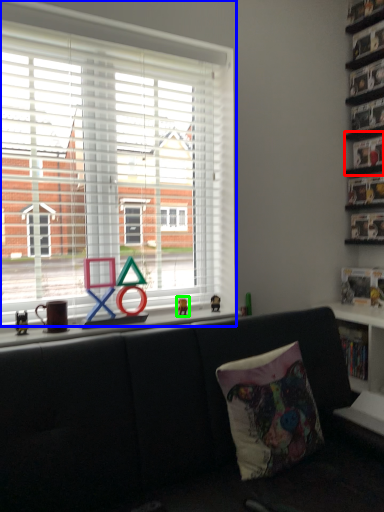
Question: Which object is positioned closest to shelf (highlighted by a red box)? Select from window (highlighted by a blue box) and miniature (highlighted by a green box).

Choices:
 (A) window
 (B) miniature

Answer: (A)